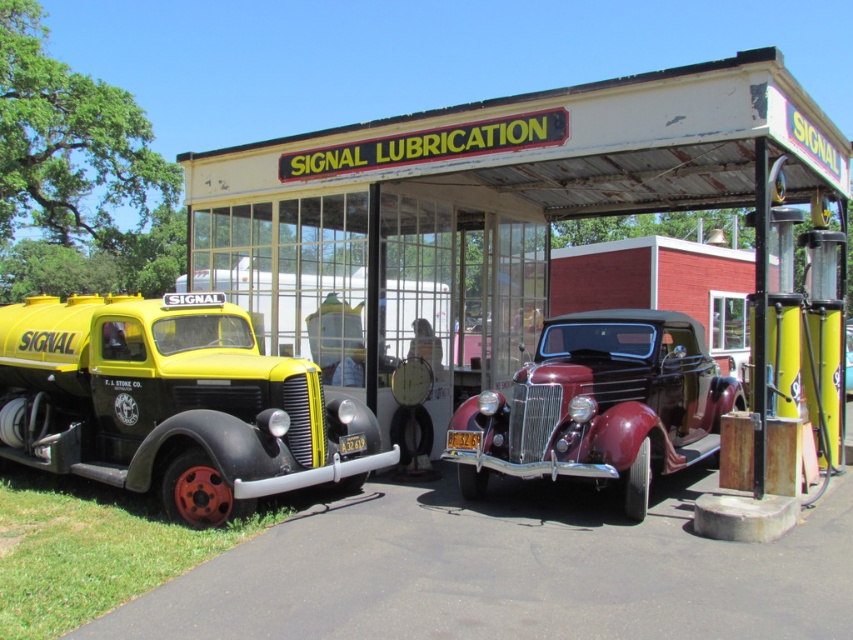
Question: Is rusty metal gas station at center thinner than yellow matte truck at left?

Choices:
 (A) yes
 (B) no

Answer: (B)

Question: Which is farther from the rusty metal gas station at center?

Choices:
 (A) shiny maroon convertible at center
 (B) yellow matte truck at left

Answer: (B)

Question: Which point is closer to the camera taking this photo?

Choices:
 (A) (198, 276)
 (B) (115, 337)
 (C) (527, 403)

Answer: (C)

Question: Does rusty metal gas station at center lie behind yellow matte truck at left?

Choices:
 (A) yes
 (B) no

Answer: (B)

Question: Is rusty metal gas station at center positioned in front of shiny maroon convertible at center?

Choices:
 (A) no
 (B) yes

Answer: (A)

Question: Which is nearer to the yellow matte truck at left?

Choices:
 (A) rusty metal gas station at center
 (B) shiny maroon convertible at center

Answer: (A)